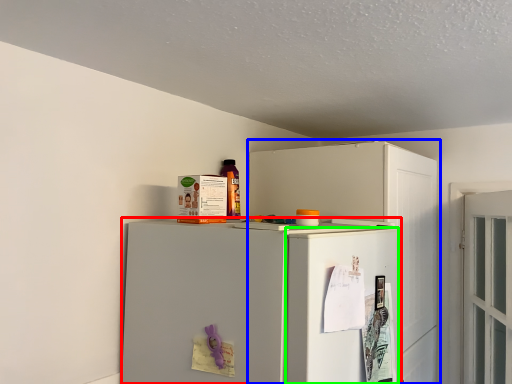
Question: Which object is the farthest from refrigerator (highlighted by a red box)? Choose among these: cabinetry (highlighted by a blue box) or door (highlighted by a green box).

Choices:
 (A) cabinetry
 (B) door

Answer: (A)